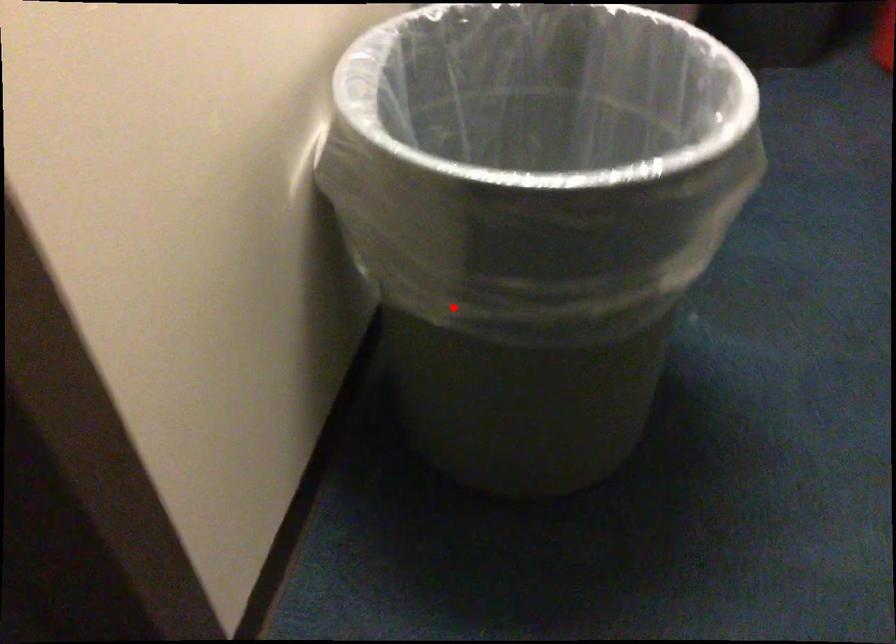
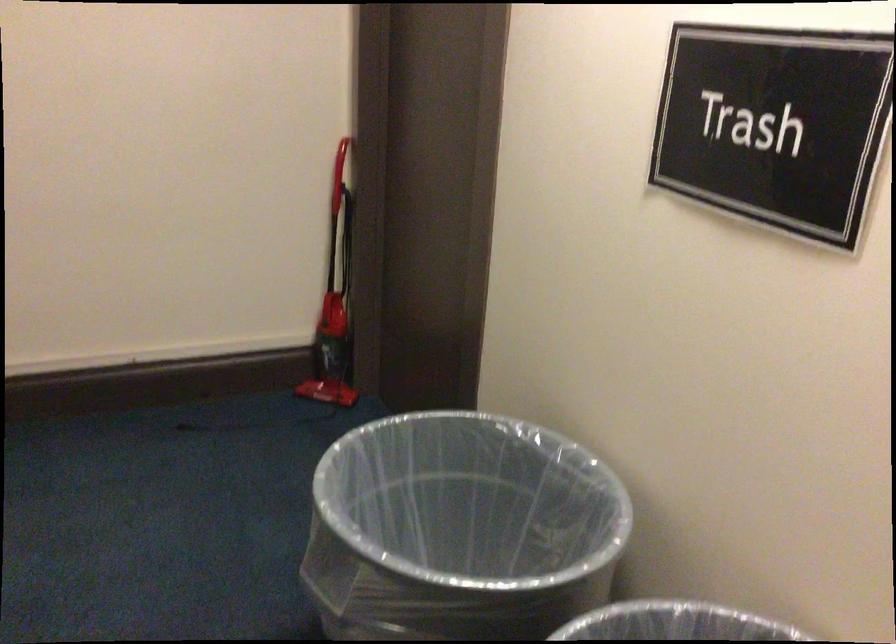
Find the pixel in the second image that matches the highlighted location in the first image.

(460, 529)